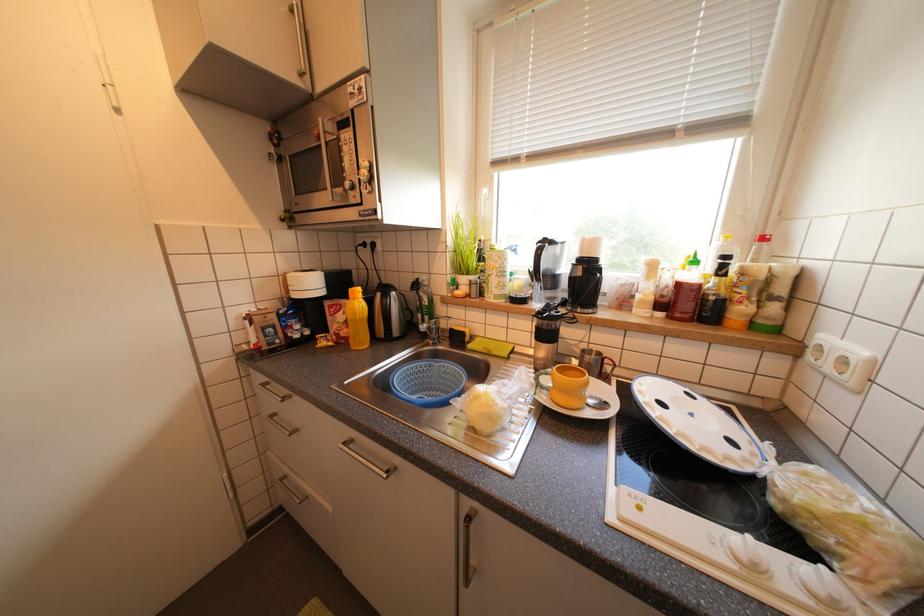
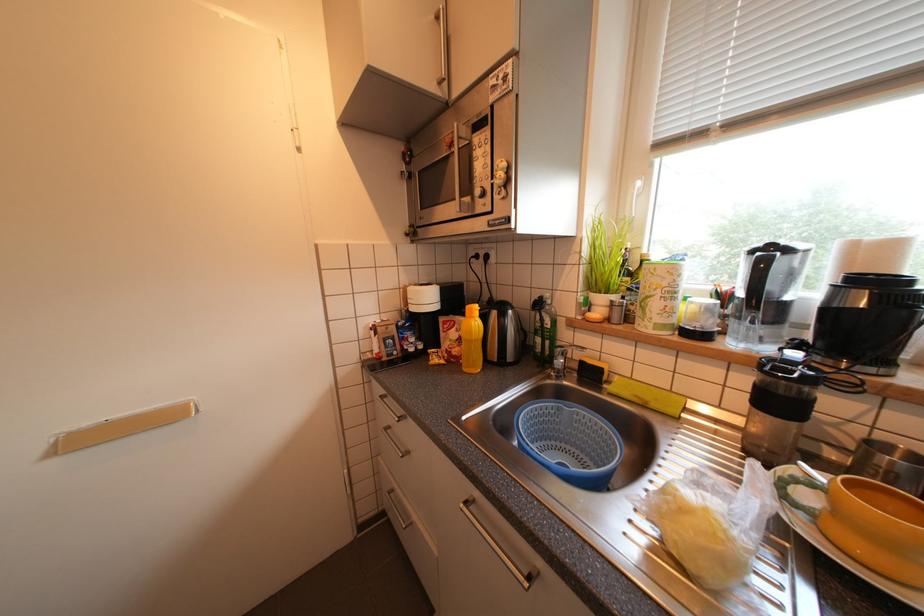
Which direction would the cameraman need to move to produce the second image?

The cameraman walked toward left, forward.